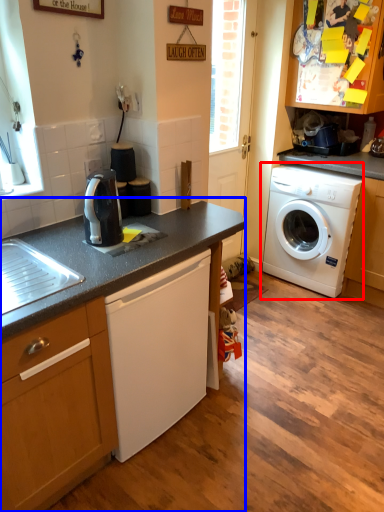
Question: Which object appears farthest to the camera in this image, washing machine (highlighted by a red box) or countertop (highlighted by a blue box)?

Choices:
 (A) washing machine
 (B) countertop

Answer: (A)